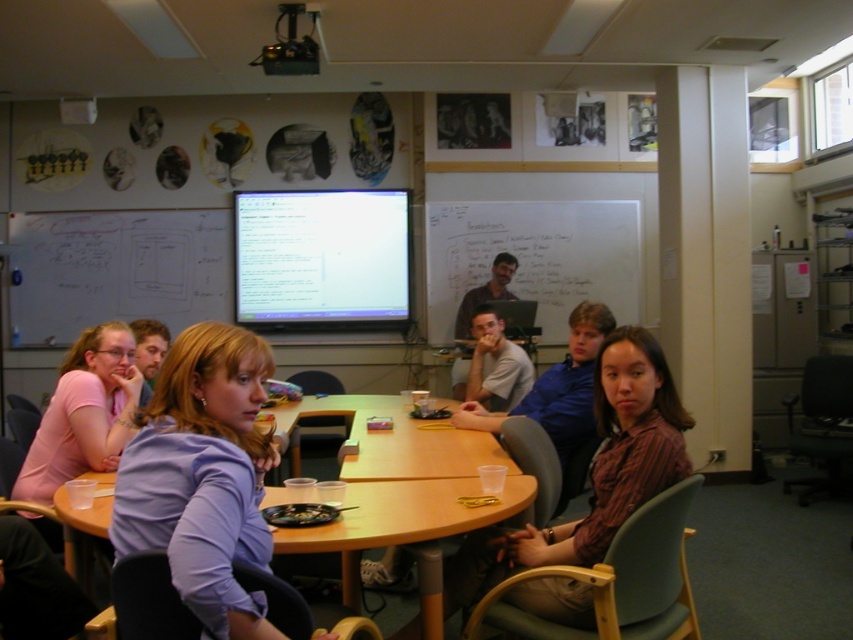
You are organizing a small event and need to place a 10 cm wide name tag on the purple shirt at center and the wooden table at center. Which object can accommodate the name tag without overlapping other items?

The wooden table at center can accommodate the name tag since it is wider than the purple shirt at center, providing enough space for the 10 cm wide name tag without overlapping other items.